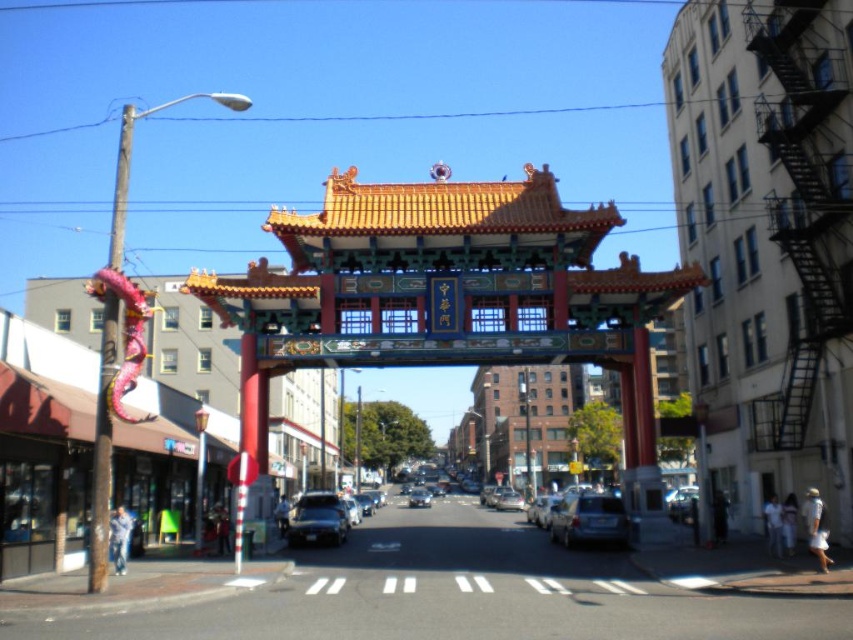
You are standing in the middle of the street looking at the archway. There are two points marked on the image. Which point, point (x=309, y=525) or point (x=422, y=500), is closer to you?

Point (x=309, y=525) is closer to you because it is closer to the camera than point (x=422, y=500).

You are driving a metallic silver sedan at center and need to park it in a spot that requires moving to the right. There is a metallic silver car at center blocking your path. Can you maneuver around it without crossing into the opposite lane?

The metallic silver sedan at center is to the left of the metallic silver car at center. Since the sedan is already positioned to the left of the car, you can maneuver around it by moving to the right side, as there is space between them. This can be done without crossing into the opposite lane.

From the picture: You are a delivery driver who needs to park your truck between the matte silver suv at center and the metallic silver sedan at center. Your truck is 18 meters long. Can you fit your truck in the space between them?

The matte silver suv at center is 17.97 meters from the metallic silver sedan at center. Since your truck is 18 meters long, which is slightly longer than the distance between them, you cannot fit your truck in the space between them.